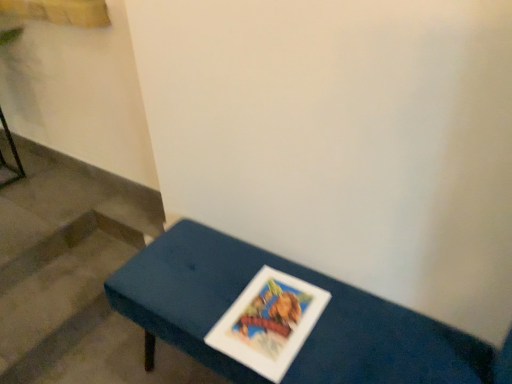
Question: Would you say wooden stairs at lower left is outside blue fabric bench at center?

Choices:
 (A) yes
 (B) no

Answer: (A)

Question: Does wooden stairs at lower left have a greater height compared to blue fabric bench at center?

Choices:
 (A) no
 (B) yes

Answer: (A)

Question: Is wooden stairs at lower left turned away from blue fabric bench at center?

Choices:
 (A) yes
 (B) no

Answer: (B)

Question: Considering the relative positions of wooden stairs at lower left and blue fabric bench at center in the image provided, is wooden stairs at lower left to the right of blue fabric bench at center from the viewer's perspective?

Choices:
 (A) yes
 (B) no

Answer: (B)

Question: Is wooden stairs at lower left directly adjacent to blue fabric bench at center?

Choices:
 (A) no
 (B) yes

Answer: (A)

Question: Is wooden stairs at lower left wider than blue fabric bench at center?

Choices:
 (A) yes
 (B) no

Answer: (A)

Question: Would you say blue fabric bench at center is outside wooden stairs at lower left?

Choices:
 (A) no
 (B) yes

Answer: (B)

Question: From a real-world perspective, does blue fabric bench at center stand above wooden stairs at lower left?

Choices:
 (A) yes
 (B) no

Answer: (A)

Question: Considering the relative sizes of blue fabric bench at center and wooden stairs at lower left in the image provided, is blue fabric bench at center shorter than wooden stairs at lower left?

Choices:
 (A) yes
 (B) no

Answer: (B)

Question: Is blue fabric bench at center taller than wooden stairs at lower left?

Choices:
 (A) yes
 (B) no

Answer: (A)

Question: Could wooden stairs at lower left be considered to be inside blue fabric bench at center?

Choices:
 (A) yes
 (B) no

Answer: (B)

Question: Does blue fabric bench at center have a greater width compared to wooden stairs at lower left?

Choices:
 (A) no
 (B) yes

Answer: (A)

Question: From the image's perspective, would you say blue fabric bench at center is positioned over metallic black stool at left?

Choices:
 (A) no
 (B) yes

Answer: (A)